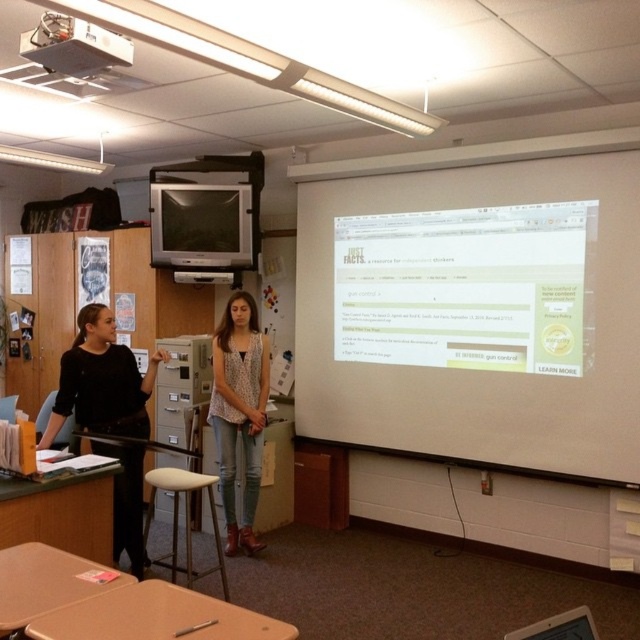
You are standing at the entrance of the classroom and want to locate the black fabric shirt at left. Based on the coordinates provided, can you determine its position relative to the center of the image?

The black fabric shirt at left is located at coordinates point 0.597 on the x axis and 0.159 on the y axis, which places it to the right and slightly below the center of the image.